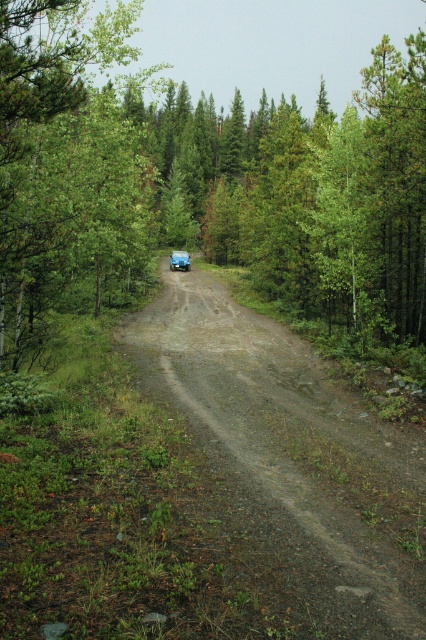
Question: Can you confirm if green leafy tree at center is positioned to the left of green leafy tree at left?

Choices:
 (A) no
 (B) yes

Answer: (A)

Question: Which object is closer to the camera taking this photo?

Choices:
 (A) green leafy tree at left
 (B) gray gravel road at center
 (C) green matte jeep at center

Answer: (B)

Question: Which of these objects is positioned closest to the green leafy tree at center?

Choices:
 (A) green leafy tree at left
 (B) green matte jeep at center

Answer: (A)

Question: Which object is closer to the camera taking this photo?

Choices:
 (A) green leafy tree at left
 (B) gray gravel road at center
 (C) green matte jeep at center

Answer: (B)

Question: Does gray gravel road at center come behind green matte jeep at center?

Choices:
 (A) yes
 (B) no

Answer: (B)

Question: Is green leafy tree at left below green matte jeep at center?

Choices:
 (A) yes
 (B) no

Answer: (B)